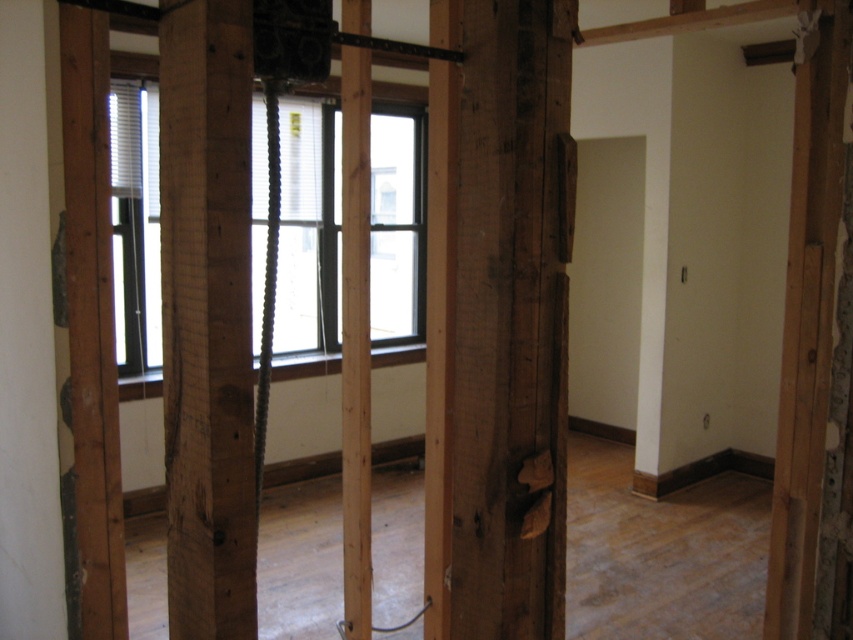
Question: Which object is farther from the camera taking this photo?

Choices:
 (A) white matte blinds at left
 (B) clear glass window at center

Answer: (B)

Question: Can you confirm if clear glass window at center is smaller than white matte blinds at left?

Choices:
 (A) no
 (B) yes

Answer: (A)

Question: Is clear glass window at center in front of white matte blinds at left?

Choices:
 (A) no
 (B) yes

Answer: (A)

Question: Does clear glass window at center have a greater width compared to white matte blinds at left?

Choices:
 (A) no
 (B) yes

Answer: (A)